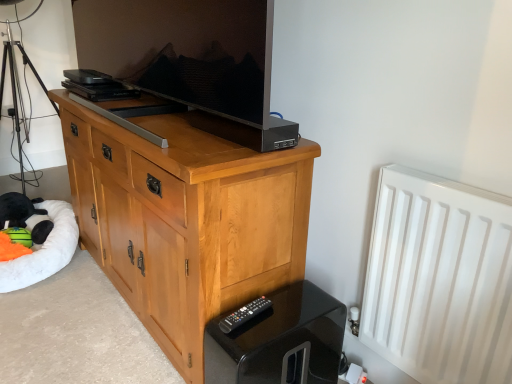
Question: Can you confirm if black plastic remote at lower center is taller than black metal tripod at left?

Choices:
 (A) no
 (B) yes

Answer: (A)

Question: Is black plastic remote at lower center closer to camera compared to black metal tripod at left?

Choices:
 (A) yes
 (B) no

Answer: (A)

Question: Is black plastic remote at lower center looking in the opposite direction of black metal tripod at left?

Choices:
 (A) no
 (B) yes

Answer: (A)

Question: From the image's perspective, is black plastic remote at lower center located above black metal tripod at left?

Choices:
 (A) yes
 (B) no

Answer: (B)

Question: Does black plastic remote at lower center have a lesser width compared to black metal tripod at left?

Choices:
 (A) no
 (B) yes

Answer: (B)

Question: Visually, is black glossy remote control at lower right positioned to the left or to the right of white fluffy dog bed at lower left?

Choices:
 (A) right
 (B) left

Answer: (A)

Question: Considering the positions of point (308, 327) and point (71, 226), is point (308, 327) closer or farther from the camera than point (71, 226)?

Choices:
 (A) farther
 (B) closer

Answer: (B)

Question: Considering the positions of black glossy remote control at lower right and white fluffy dog bed at lower left in the image, is black glossy remote control at lower right wider or thinner than white fluffy dog bed at lower left?

Choices:
 (A) thin
 (B) wide

Answer: (A)

Question: From the image's perspective, is black glossy remote control at lower right above or below white fluffy dog bed at lower left?

Choices:
 (A) below
 (B) above

Answer: (A)

Question: Considering the positions of matte black television at center and black glossy remote control at lower right in the image, is matte black television at center wider or thinner than black glossy remote control at lower right?

Choices:
 (A) wide
 (B) thin

Answer: (B)

Question: Based on their positions, is matte black television at center located to the left or right of black glossy remote control at lower right?

Choices:
 (A) left
 (B) right

Answer: (A)

Question: Is matte black television at center taller or shorter than black glossy remote control at lower right?

Choices:
 (A) short
 (B) tall

Answer: (B)

Question: Is matte black television at center bigger or smaller than black glossy remote control at lower right?

Choices:
 (A) big
 (B) small

Answer: (A)

Question: From the image's perspective, is black plush toy at lower left positioned above or below black glossy remote control at lower right?

Choices:
 (A) below
 (B) above

Answer: (B)

Question: Relative to black glossy remote control at lower right, is black plush toy at lower left in front or behind?

Choices:
 (A) front
 (B) behind

Answer: (B)